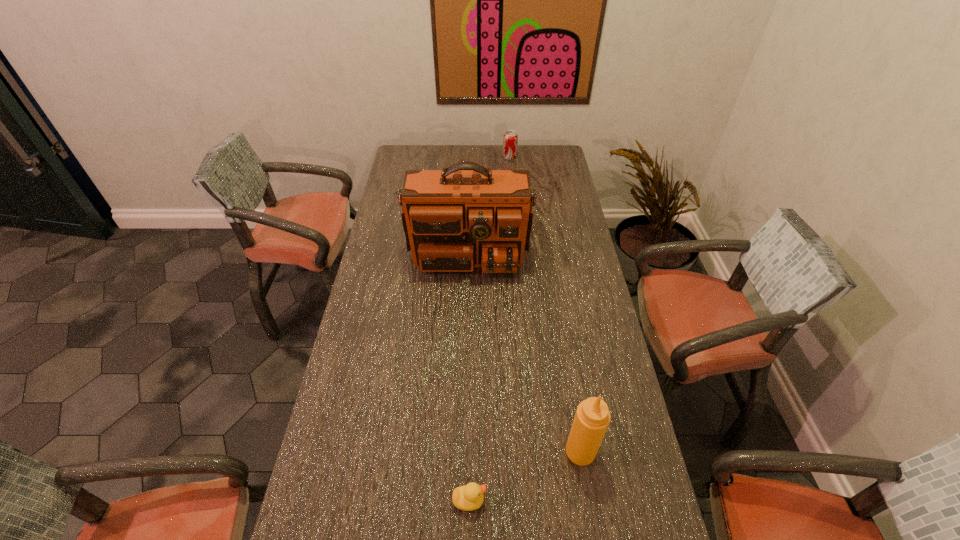
The width and height of the screenshot is (960, 540). In order to click on free space located 0.080m on the back of the farthest object in this screenshot , I will do `click(509, 145)`.

I want to click on free location located on the face of the nearest object, so click(649, 501).

Identify the location of object located at the far edge. (510, 139).

This screenshot has width=960, height=540. What are the coordinates of `object that is positioned at the left edge` in the screenshot? It's located at (463, 216).

The image size is (960, 540). I want to click on object located at the right edge, so click(592, 417).

In order to click on vacant space at the left edge of the desktop in this screenshot , I will do `click(366, 393)`.

This screenshot has width=960, height=540. Identify the location of vacant space at the right edge. (567, 225).

Image resolution: width=960 pixels, height=540 pixels. In order to click on vacant space at the far left corner of the desktop in this screenshot , I will do `click(396, 161)`.

At what (x,y) coordinates should I click in order to perform the action: click on vacant space that's between the duckling and the farthest object. Please return your answer as a coordinate pair (x, y). Looking at the image, I should click on (490, 328).

Locate an element on the screen. vacant space that's between the condiment and the nearest object is located at coordinates (525, 476).